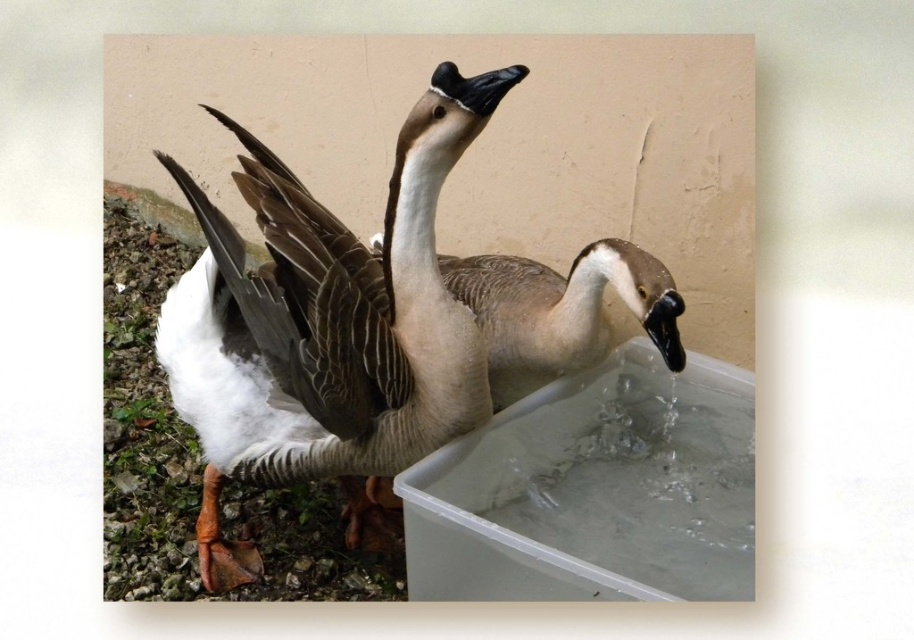
You are a photographer trying to capture both the white matte goose at center and the gray matte goose at center in a single shot. Which goose is closer to the camera based on their positions?

The white matte goose at center is positioned under the gray matte goose at center, so the white matte goose at center is closer to the camera.